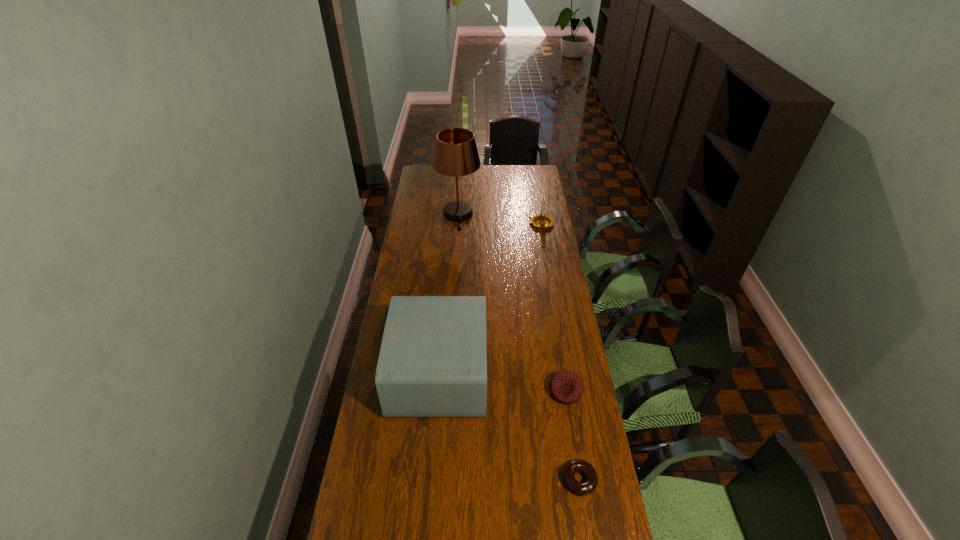
Image resolution: width=960 pixels, height=540 pixels. I want to click on the closest object to the nearest object, so click(x=566, y=386).

You are a GUI agent. You are given a task and a screenshot of the screen. Output one action in this format:
    pyautogui.click(x=<x>, y=<y>)
    Task: Click on the free space that satisfies the following two spatial constraints: 1. on the front panel of the fourth shortest object; 2. on the right side of the doughnut
    This screenshot has width=960, height=540.
    Given the screenshot: What is the action you would take?
    pyautogui.click(x=431, y=480)

The width and height of the screenshot is (960, 540). In order to click on vacant region that satisfies the following two spatial constraints: 1. on the front panel of the second tallest object; 2. on the left side of the shortest object in this screenshot , I will do `click(431, 480)`.

Where is `free region that satisfies the following two spatial constraints: 1. on the front side of the candle holder; 2. on the front panel of the second tallest object`? This screenshot has height=540, width=960. free region that satisfies the following two spatial constraints: 1. on the front side of the candle holder; 2. on the front panel of the second tallest object is located at coordinates (565, 372).

Where is `vacant region that satisfies the following two spatial constraints: 1. on the front-facing side of the lampshade; 2. on the right side of the nearest object`? vacant region that satisfies the following two spatial constraints: 1. on the front-facing side of the lampshade; 2. on the right side of the nearest object is located at coordinates (442, 480).

Where is `vacant position in the image that satisfies the following two spatial constraints: 1. on the back side of the candle holder; 2. on the right side of the beanbag`? This screenshot has height=540, width=960. vacant position in the image that satisfies the following two spatial constraints: 1. on the back side of the candle holder; 2. on the right side of the beanbag is located at coordinates (539, 224).

At what (x,y) coordinates should I click in order to perform the action: click on vacant space that satisfies the following two spatial constraints: 1. on the front-facing side of the lampshade; 2. on the front panel of the radio receiver. Please return your answer as a coordinate pair (x, y). The image size is (960, 540). Looking at the image, I should click on (448, 372).

Identify the location of vacant region that satisfies the following two spatial constraints: 1. on the front-facing side of the tallest object; 2. on the right side of the candle holder. Image resolution: width=960 pixels, height=540 pixels. (458, 224).

Find the location of `free spot that satisfies the following two spatial constraints: 1. on the front-facing side of the shortest object; 2. on the right side of the tallest object`. free spot that satisfies the following two spatial constraints: 1. on the front-facing side of the shortest object; 2. on the right side of the tallest object is located at coordinates (442, 480).

Image resolution: width=960 pixels, height=540 pixels. In order to click on free point that satisfies the following two spatial constraints: 1. on the front panel of the second shortest object; 2. on the right side of the radio receiver in this screenshot , I will do `click(439, 392)`.